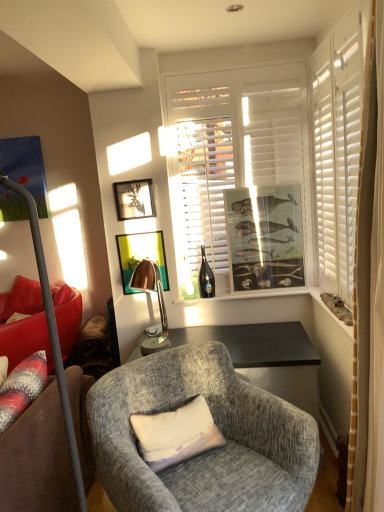
The height and width of the screenshot is (512, 384). In order to click on matte wooden picture frame at center, which ranks as the third picture frame in left-to-right order in this screenshot , I will do `click(265, 237)`.

Describe the element at coordinates (247, 295) in the screenshot. I see `matte glass window sill at center, the first window sill viewed from the left` at that location.

Measure the distance between point (x=156, y=339) and camera.

Point (x=156, y=339) is 2.56 meters from camera.

You are a GUI agent. You are given a task and a screenshot of the screen. Output one action in this format:
    pyautogui.click(x=<x>, y=<y>)
    Task: Click on the copper metallic lamp at center, which is the 1th lamp from right to left
    This screenshot has width=384, height=512.
    Given the screenshot: What is the action you would take?
    pyautogui.click(x=158, y=302)

Identify the location of white textured stone at right, the second window sill when ordered from back to front. (329, 310).

The height and width of the screenshot is (512, 384). I want to click on white wood window at center, so click(x=232, y=147).

Where is `pastel fabric pillow at center`? pastel fabric pillow at center is located at coordinates (176, 434).

Where is `matte wooden picture frame at center, the first picture frame in the right-to-left sequence`? This screenshot has height=512, width=384. matte wooden picture frame at center, the first picture frame in the right-to-left sequence is located at coordinates (265, 237).

Looking at this image, from a real-world perspective, does textured gray armchair at center stand above matte glass window sill at center, the first window sill viewed from the left?

No, from a real-world perspective, textured gray armchair at center is not on top of matte glass window sill at center, the first window sill viewed from the left.

Between textured gray armchair at center and matte glass window sill at center, the first window sill viewed from the left, which one has more height?

textured gray armchair at center.

Which object is closer to the camera, textured gray armchair at center or matte glass window sill at center, marked as the second window sill in a front-to-back arrangement?

Positioned in front is textured gray armchair at center.

Find the location of a particular element. The width and height of the screenshot is (384, 512). chair that is in front of the matte glass window sill at center, the first window sill viewed from the left is located at coordinates (207, 452).

Is translucent glass bottle at center turned away from metallic silver lamp at left, the second lamp when ordered from right to left?

No, translucent glass bottle at center is not facing the opposite direction of metallic silver lamp at left, the second lamp when ordered from right to left.

Is translucent glass bottle at center situated inside metallic silver lamp at left, which ranks as the first lamp in left-to-right order, or outside?

translucent glass bottle at center is located beyond the bounds of metallic silver lamp at left, which ranks as the first lamp in left-to-right order.

Consider the image. Does translucent glass bottle at center have a greater height compared to metallic silver lamp at left, arranged as the second lamp when viewed from the back?

No, translucent glass bottle at center is not taller than metallic silver lamp at left, arranged as the second lamp when viewed from the back.

Considering the positions of objects translucent glass bottle at center and metallic silver lamp at left, the 1th lamp when ordered from front to back, in the image provided, who is more to the left, translucent glass bottle at center or metallic silver lamp at left, the 1th lamp when ordered from front to back,?

metallic silver lamp at left, the 1th lamp when ordered from front to back, is more to the left.

Considering the positions of objects matte glass window sill at center, marked as the second window sill in a front-to-back arrangement, and pastel fabric pillow at center in the image provided, who is in front, matte glass window sill at center, marked as the second window sill in a front-to-back arrangement, or pastel fabric pillow at center?

pastel fabric pillow at center is in front.

In order to click on the 2nd window sill positioned above the pastel fabric pillow at center (from the image's perspective) in this screenshot , I will do `click(247, 295)`.

From the picture: From a real-world perspective, is matte glass window sill at center, which ranks as the first window sill in back-to-front order, positioned above or below pastel fabric pillow at center?

From a real-world perspective, matte glass window sill at center, which ranks as the first window sill in back-to-front order, is physically above pastel fabric pillow at center.

From the image's perspective, would you say matte glass window sill at center, the first window sill viewed from the left, is positioned over pastel fabric pillow at center?

Yes.

Considering the relative sizes of metallic gold picture frame at center, marked as the second picture frame in a right-to-left arrangement, and metallic silver picture frame at upper center, which ranks as the 1th picture frame in left-to-right order, in the image provided, is metallic gold picture frame at center, marked as the second picture frame in a right-to-left arrangement, smaller than metallic silver picture frame at upper center, which ranks as the 1th picture frame in left-to-right order,?

Yes, metallic gold picture frame at center, marked as the second picture frame in a right-to-left arrangement, is smaller than metallic silver picture frame at upper center, which ranks as the 1th picture frame in left-to-right order.

From the picture: Which object is closer to the camera taking this photo, metallic gold picture frame at center, the 2th picture frame in the left-to-right sequence, or metallic silver picture frame at upper center, which ranks as the 1th picture frame in left-to-right order?

metallic silver picture frame at upper center, which ranks as the 1th picture frame in left-to-right order, is in front.

From a real-world perspective, is metallic gold picture frame at center, the 2th picture frame in the left-to-right sequence, above or below metallic silver picture frame at upper center, the 3th picture frame positioned from the right?

In terms of real-world spatial position, metallic gold picture frame at center, the 2th picture frame in the left-to-right sequence, is below metallic silver picture frame at upper center, the 3th picture frame positioned from the right.

Which is closer to the camera, (158, 256) or (117, 186)?

Clearly, point (158, 256) is more distant from the camera than point (117, 186).

Is pastel fabric pillow at center situated inside metallic silver picture frame at upper center, which ranks as the 1th picture frame in left-to-right order, or outside?

pastel fabric pillow at center is outside metallic silver picture frame at upper center, which ranks as the 1th picture frame in left-to-right order.

Is pastel fabric pillow at center looking in the opposite direction of metallic silver picture frame at upper center, the 3th picture frame positioned from the right?

That's not correct — pastel fabric pillow at center is not looking away from metallic silver picture frame at upper center, the 3th picture frame positioned from the right.

From a real-world perspective, is pastel fabric pillow at center on metallic silver picture frame at upper center, the 3th picture frame positioned from the right?

No.

Does pastel fabric pillow at center lie in front of metallic silver picture frame at upper center, the 3th picture frame positioned from the right?

Yes, it is.

From a real-world perspective, is metallic gold picture frame at center, the 2th picture frame in the left-to-right sequence, on white wood window at center?

No.

Does point (129, 288) come farther from viewer compared to point (221, 206)?

No, it is in front of (221, 206).

Could you tell me if metallic gold picture frame at center, the 2th picture frame in the left-to-right sequence, is turned towards white wood window at center?

No, metallic gold picture frame at center, the 2th picture frame in the left-to-right sequence, does not turn towards white wood window at center.

Would you say metallic gold picture frame at center, the 2th picture frame in the left-to-right sequence, is inside or outside white wood window at center?

metallic gold picture frame at center, the 2th picture frame in the left-to-right sequence, lies outside white wood window at center.

Is textured gray armchair at center next to metallic silver lamp at left, arranged as the second lamp when viewed from the back?

textured gray armchair at center is not next to metallic silver lamp at left, arranged as the second lamp when viewed from the back, and they're not touching.

Which of these two, textured gray armchair at center or metallic silver lamp at left, arranged as the second lamp when viewed from the back, is wider?

Wider between the two is textured gray armchair at center.

Can you tell me how much textured gray armchair at center and metallic silver lamp at left, the 1th lamp when ordered from front to back, differ in facing direction?

The angular difference between textured gray armchair at center and metallic silver lamp at left, the 1th lamp when ordered from front to back, is 131 degrees.

What are the coordinates of `chair on the left of the matte glass window sill at center, the 2th window sill from the right` in the screenshot? It's located at (207, 452).

Find the location of a particular element. This screenshot has width=384, height=512. bottle on the right of metallic silver lamp at left, arranged as the second lamp when viewed from the back is located at coordinates (206, 277).

When comparing their distances from white textured stone at right, which is counted as the 2th window sill, starting from the left, does pastel fabric pillow at center or matte wooden picture frame at center, which ranks as the third picture frame in left-to-right order, seem further?

pastel fabric pillow at center lies further to white textured stone at right, which is counted as the 2th window sill, starting from the left, than the other object.

Which object lies nearer to the anchor point white textured stone at right, which is counted as the 2th window sill, starting from the left, metallic silver picture frame at upper center, the 3th picture frame positioned from the right, or white wood window at center?

white wood window at center lies closer to white textured stone at right, which is counted as the 2th window sill, starting from the left, than the other object.

Estimate the real-world distances between objects in this image. Which object is closer to copper metallic lamp at center, positioned as the second lamp in front-to-back order, matte glass window sill at center, the first window sill viewed from the left, or textured gray armchair at center?

matte glass window sill at center, the first window sill viewed from the left, lies closer to copper metallic lamp at center, positioned as the second lamp in front-to-back order, than the other object.

Which object lies further to the anchor point copper metallic lamp at center, which is the 1th lamp from right to left, matte wooden picture frame at center, which ranks as the third picture frame in left-to-right order, or textured gray armchair at center?

Based on the image, textured gray armchair at center appears to be further to copper metallic lamp at center, which is the 1th lamp from right to left.

Which object lies nearer to the anchor point textured gray armchair at center, metallic silver picture frame at upper center, which ranks as the 1th picture frame in left-to-right order, or copper metallic lamp at center, which is the 1th lamp from right to left?

Among the two, copper metallic lamp at center, which is the 1th lamp from right to left, is located nearer to textured gray armchair at center.

When comparing their distances from white wood window at center, does pastel fabric pillow at center or white textured stone at right, acting as the 1th window sill starting from the right, seem closer?

white textured stone at right, acting as the 1th window sill starting from the right.

Considering their positions, is red fabric couch at left positioned further to textured gray armchair at center than white textured stone at right, which is counted as the 2th window sill, starting from the left?

white textured stone at right, which is counted as the 2th window sill, starting from the left, lies further to textured gray armchair at center than the other object.

Which object lies further to the anchor point white textured stone at right, acting as the 1th window sill starting from the right, textured gray armchair at center or red fabric couch at left?

red fabric couch at left is further to white textured stone at right, acting as the 1th window sill starting from the right.

Identify the location of window sill that lies between white wood window at center and copper metallic lamp at center, the 1th lamp positioned from the back, from top to bottom. (247, 295).

The width and height of the screenshot is (384, 512). I want to click on lamp positioned between pastel fabric pillow at center and matte wooden picture frame at center, which ranks as the third picture frame in left-to-right order, from near to far, so click(x=158, y=302).

You are a GUI agent. You are given a task and a screenshot of the screen. Output one action in this format:
    pyautogui.click(x=<x>, y=<y>)
    Task: Click on the bottle positioned between white textured stone at right, which is counted as the 2th window sill, starting from the left, and matte glass window sill at center, which ranks as the first window sill in back-to-front order, from near to far
    The image size is (384, 512).
    Given the screenshot: What is the action you would take?
    pyautogui.click(x=206, y=277)

Identify the location of bottle situated between metallic silver picture frame at upper center, the 3th picture frame positioned from the right, and matte wooden picture frame at center, which ranks as the third picture frame in left-to-right order, from left to right. The height and width of the screenshot is (512, 384). (206, 277).